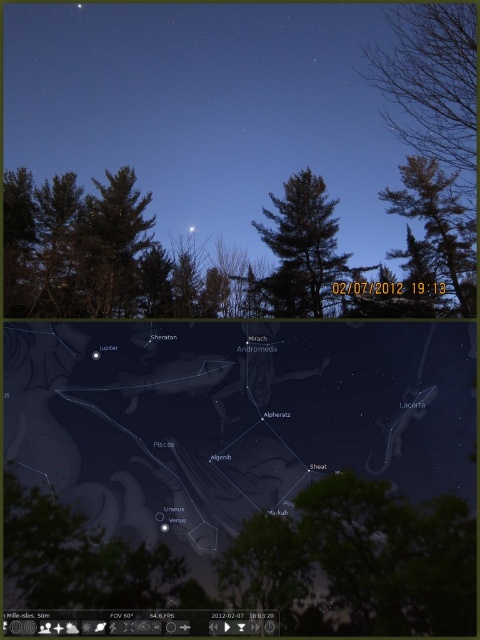
Question: Estimate the real-world distances between objects in this image. Which object is closer to the brown textured tree at left?

Choices:
 (A) transparent overlay at center
 (B) green matte tree at center
 (C) matte black stars at upper center
 (D) bare branches at upper right

Answer: (C)

Question: Observing the image, what is the correct spatial positioning of bare branches at upper right in reference to green matte tree at center?

Choices:
 (A) right
 (B) left

Answer: (A)

Question: Which point is farther from the camera taking this photo?

Choices:
 (A) (227, 173)
 (B) (372, 84)
 (C) (456, 209)
 (D) (269, 240)

Answer: (A)

Question: Is the position of transparent overlay at center less distant than that of green matte tree at center?

Choices:
 (A) yes
 (B) no

Answer: (A)

Question: Where is matte black stars at upper center located in relation to brown textured tree at left in the image?

Choices:
 (A) right
 (B) left

Answer: (A)

Question: Which object is the closest to the brown textured tree at left?

Choices:
 (A) green matte tree at center
 (B) bare branches at upper right
 (C) matte black stars at upper center

Answer: (C)